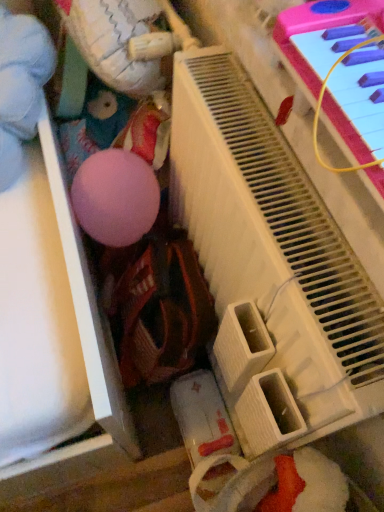
Question: Considering the relative sizes of matte pink ball at upper left, the second toy when ordered from right to left, and white matte plush at upper left, the second toy from the left, in the image provided, is matte pink ball at upper left, the second toy when ordered from right to left, thinner than white matte plush at upper left, the second toy from the left,?

Choices:
 (A) no
 (B) yes

Answer: (A)

Question: Considering the relative sizes of matte pink ball at upper left, the 1th toy positioned from the left, and white matte plush at upper left, which ranks as the 1th toy in right-to-left order, in the image provided, is matte pink ball at upper left, the 1th toy positioned from the left, smaller than white matte plush at upper left, which ranks as the 1th toy in right-to-left order,?

Choices:
 (A) yes
 (B) no

Answer: (A)

Question: Does matte pink ball at upper left, the second toy when ordered from right to left, lie in front of white matte plush at upper left, which ranks as the 1th toy in right-to-left order?

Choices:
 (A) yes
 (B) no

Answer: (B)

Question: Does matte pink ball at upper left, the second toy when ordered from right to left, lie behind white matte plush at upper left, which ranks as the 1th toy in right-to-left order?

Choices:
 (A) no
 (B) yes

Answer: (B)

Question: From a real-world perspective, is matte pink ball at upper left, the 1th toy positioned from the left, positioned under white matte plush at upper left, which ranks as the 1th toy in right-to-left order, based on gravity?

Choices:
 (A) yes
 (B) no

Answer: (A)

Question: From a real-world perspective, is pink plastic piano at upper right positioned above or below matte pink ball at upper left, the second toy when ordered from right to left?

Choices:
 (A) below
 (B) above

Answer: (A)

Question: Is pink plastic piano at upper right inside or outside of matte pink ball at upper left, the second toy when ordered from right to left?

Choices:
 (A) inside
 (B) outside

Answer: (B)

Question: Does point (273, 435) appear closer or farther from the camera than point (36, 109)?

Choices:
 (A) closer
 (B) farther

Answer: (A)

Question: Considering the positions of pink plastic piano at upper right and matte pink ball at upper left, the 1th toy positioned from the left, in the image, is pink plastic piano at upper right wider or thinner than matte pink ball at upper left, the 1th toy positioned from the left,?

Choices:
 (A) wide
 (B) thin

Answer: (B)

Question: Considering the positions of white matte plush at upper left, the second toy from the left, and matte pink ball at upper left, the 1th toy positioned from the left, in the image, is white matte plush at upper left, the second toy from the left, taller or shorter than matte pink ball at upper left, the 1th toy positioned from the left,?

Choices:
 (A) tall
 (B) short

Answer: (A)

Question: Which is correct: white matte plush at upper left, which ranks as the 1th toy in right-to-left order, is inside matte pink ball at upper left, the 1th toy positioned from the left, or outside of it?

Choices:
 (A) outside
 (B) inside

Answer: (A)

Question: Considering the positions of point (81, 39) and point (8, 12), is point (81, 39) closer or farther from the camera than point (8, 12)?

Choices:
 (A) closer
 (B) farther

Answer: (A)

Question: From the image's perspective, is white matte plush at upper left, which ranks as the 1th toy in right-to-left order, located above or below matte pink ball at upper left, the second toy when ordered from right to left?

Choices:
 (A) above
 (B) below

Answer: (A)

Question: Considering their positions, is white matte plush at upper left, the second toy from the left, located in front of or behind pink plastic piano at upper right?

Choices:
 (A) front
 (B) behind

Answer: (B)

Question: Looking at their shapes, would you say white matte plush at upper left, which ranks as the 1th toy in right-to-left order, is wider or thinner than pink plastic piano at upper right?

Choices:
 (A) wide
 (B) thin

Answer: (A)